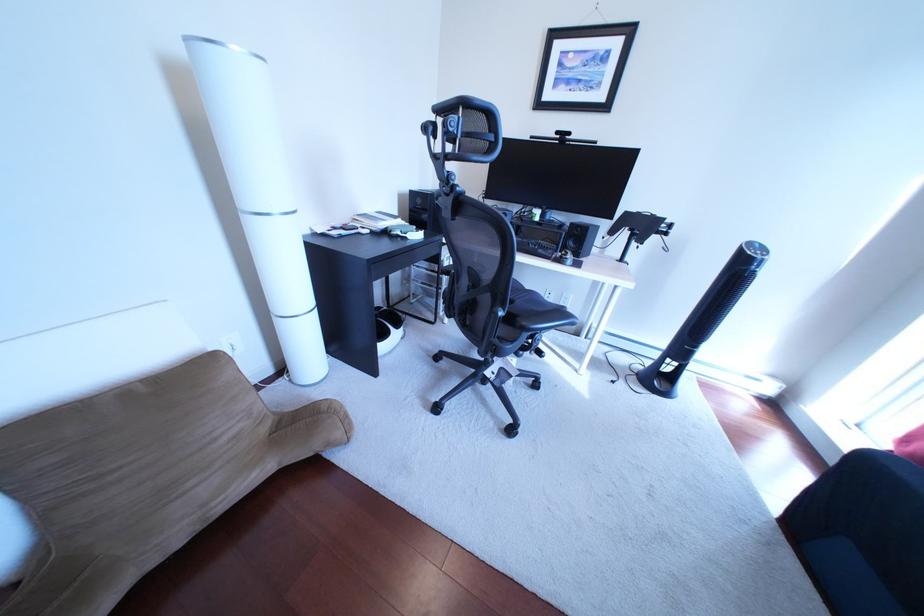
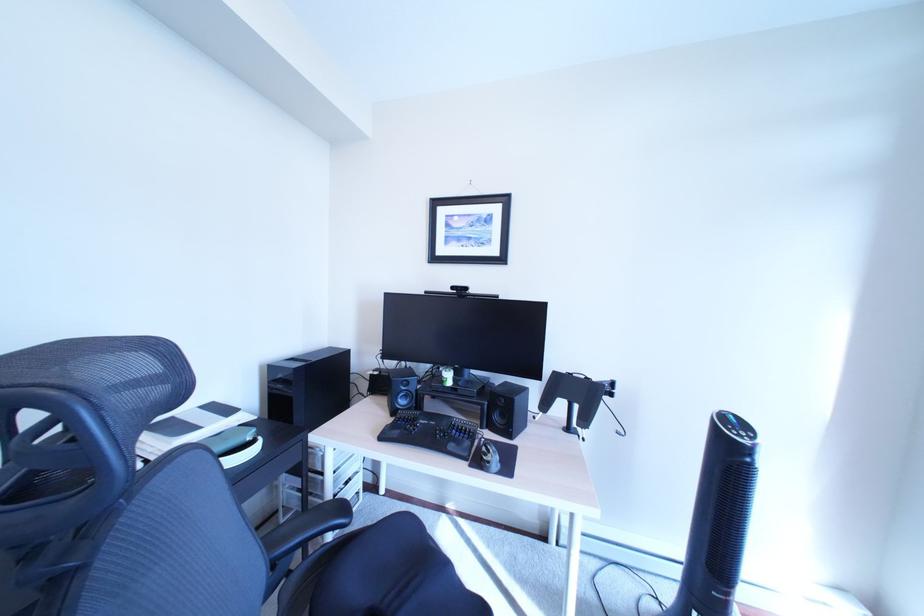
Which direction would the cameraman need to move to produce the second image?

The movement direction of the cameraman is right, forward.